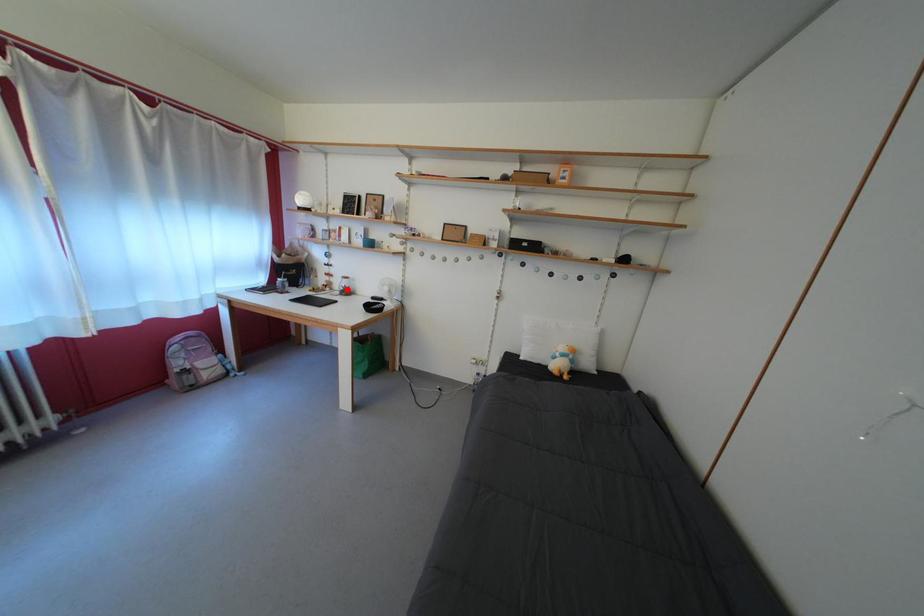
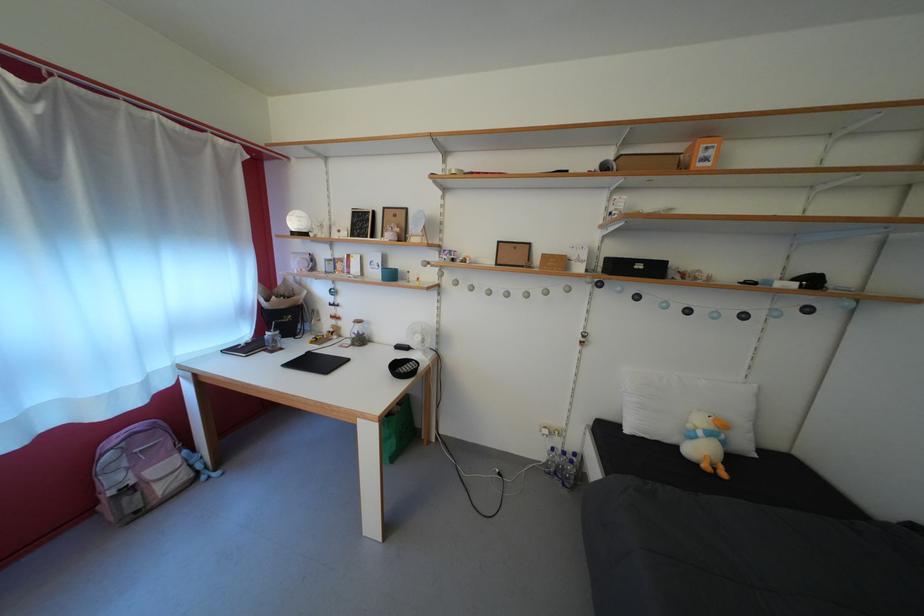
Find the pixel in the second image that matches the highlighted location in the first image.

(358, 334)